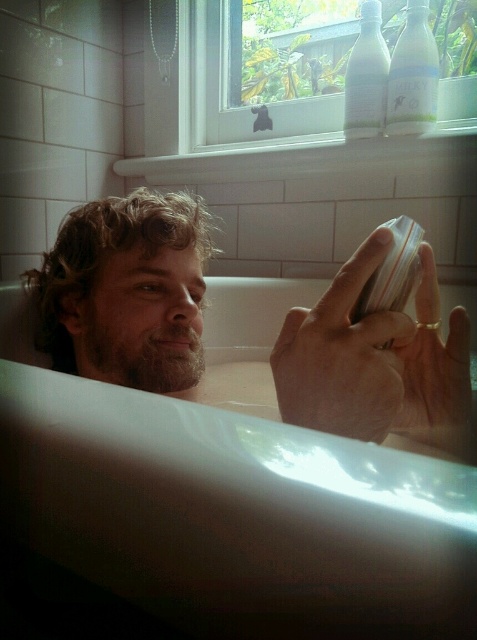
You are a photographer trying to capture a closeup shot of the gold metallic ring at upper center without including the curly hair at left in the frame. Is this possible given their positions?

The curly hair at left is located above the gold metallic ring at upper center, so you can position the camera below the ring to avoid capturing the curly hair at left in the frame.

What is the location of the point with coordinates [126,291] in the scene?

The point with coordinates [126,291] is located on the curly hair at left.